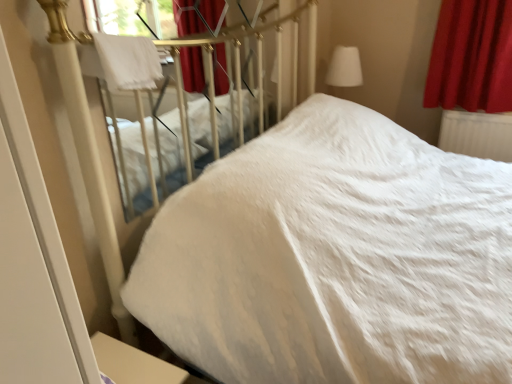
Question: Considering the relative sizes of white soft bed at upper left, the second bed viewed from the right, and white plastic radiator at right in the image provided, is white soft bed at upper left, the second bed viewed from the right, taller than white plastic radiator at right?

Choices:
 (A) no
 (B) yes

Answer: (B)

Question: Are white soft bed at upper left, which appears as the 1th bed when viewed from the left, and white plastic radiator at right making contact?

Choices:
 (A) no
 (B) yes

Answer: (A)

Question: Can you confirm if white soft bed at upper left, the second bed viewed from the right, is smaller than white plastic radiator at right?

Choices:
 (A) no
 (B) yes

Answer: (A)

Question: Is white soft bed at upper left, the second bed viewed from the right, shorter than white plastic radiator at right?

Choices:
 (A) no
 (B) yes

Answer: (A)

Question: Is white soft bed at upper left, which appears as the 1th bed when viewed from the left, positioned with its back to white plastic radiator at right?

Choices:
 (A) no
 (B) yes

Answer: (A)

Question: From their relative heights in the image, would you say velvet red curtain at upper right is taller or shorter than white fabric lampshade at upper right?

Choices:
 (A) tall
 (B) short

Answer: (A)

Question: Does point (485, 14) appear closer or farther from the camera than point (336, 52)?

Choices:
 (A) closer
 (B) farther

Answer: (A)

Question: Is velvet red curtain at upper right wider or thinner than white fabric lampshade at upper right?

Choices:
 (A) wide
 (B) thin

Answer: (B)

Question: From the image's perspective, is velvet red curtain at upper right positioned above or below white fabric lampshade at upper right?

Choices:
 (A) above
 (B) below

Answer: (B)

Question: From the image's perspective, is white soft bed at upper left, which appears as the 1th bed when viewed from the left, located above or below white fabric lampshade at upper right?

Choices:
 (A) above
 (B) below

Answer: (B)

Question: Considering the positions of point (293, 48) and point (331, 59), is point (293, 48) closer or farther from the camera than point (331, 59)?

Choices:
 (A) farther
 (B) closer

Answer: (B)

Question: In terms of height, does white soft bed at upper left, which appears as the 1th bed when viewed from the left, look taller or shorter compared to white fabric lampshade at upper right?

Choices:
 (A) tall
 (B) short

Answer: (A)

Question: In terms of width, does white soft bed at upper left, which appears as the 1th bed when viewed from the left, look wider or thinner when compared to white fabric lampshade at upper right?

Choices:
 (A) thin
 (B) wide

Answer: (A)

Question: Relative to white soft bed at center, which appears as the second bed when viewed from the left, is white soft bed at upper left, which appears as the 1th bed when viewed from the left, in front or behind?

Choices:
 (A) behind
 (B) front

Answer: (A)

Question: From a real-world perspective, is white soft bed at upper left, the second bed viewed from the right, physically located above or below white soft bed at center, the first bed in the right-to-left sequence?

Choices:
 (A) below
 (B) above

Answer: (B)